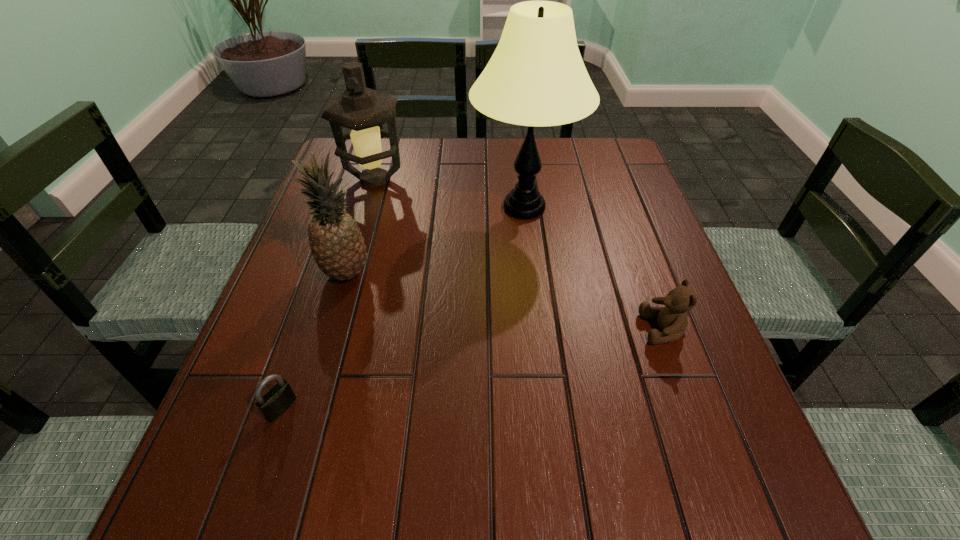
The width and height of the screenshot is (960, 540). What are the coordinates of `free region located 0.350m on the front of the third nearest object` in the screenshot? It's located at (292, 459).

I want to click on blank area located on the front-facing side of the second nearest object, so click(x=606, y=329).

This screenshot has width=960, height=540. Find the location of `vacant space located 0.280m on the front-facing side of the second nearest object`. vacant space located 0.280m on the front-facing side of the second nearest object is located at coordinates (497, 329).

This screenshot has width=960, height=540. Find the location of `free spot located 0.370m on the front-facing side of the second nearest object`. free spot located 0.370m on the front-facing side of the second nearest object is located at coordinates (451, 329).

Locate an element on the screen. vacant space situated on the front of the padlock is located at coordinates (248, 508).

At what (x,y) coordinates should I click in order to perform the action: click on lamp that is at the far edge. Please return your answer as a coordinate pair (x, y). The height and width of the screenshot is (540, 960). Looking at the image, I should click on (536, 77).

The width and height of the screenshot is (960, 540). I want to click on oil lamp that is at the far edge, so click(361, 109).

Identify the location of oil lamp at the left edge. [x=361, y=109].

This screenshot has width=960, height=540. Find the location of `pineapple that is at the left edge`. pineapple that is at the left edge is located at coordinates (336, 242).

Where is `padlock situated at the left edge`? Image resolution: width=960 pixels, height=540 pixels. padlock situated at the left edge is located at coordinates (279, 398).